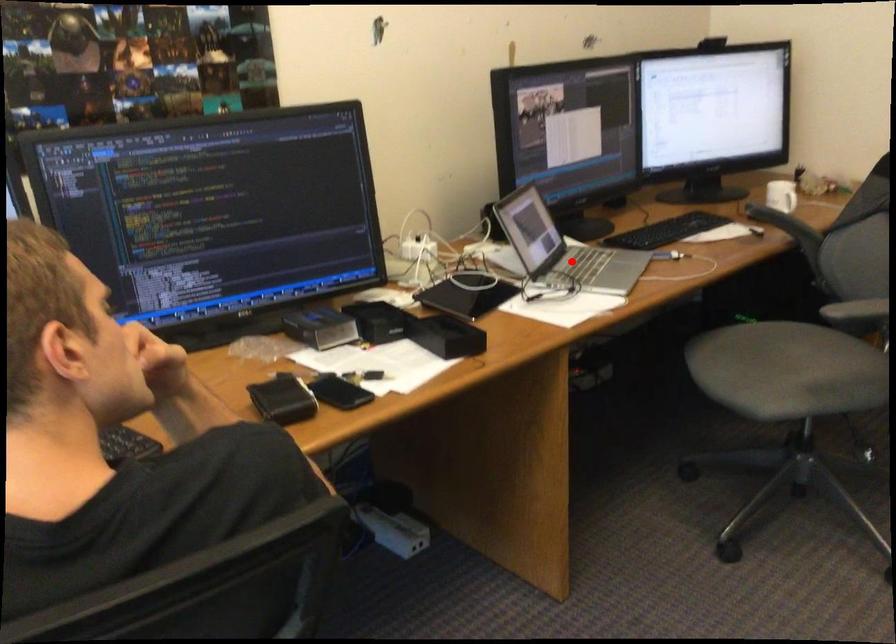
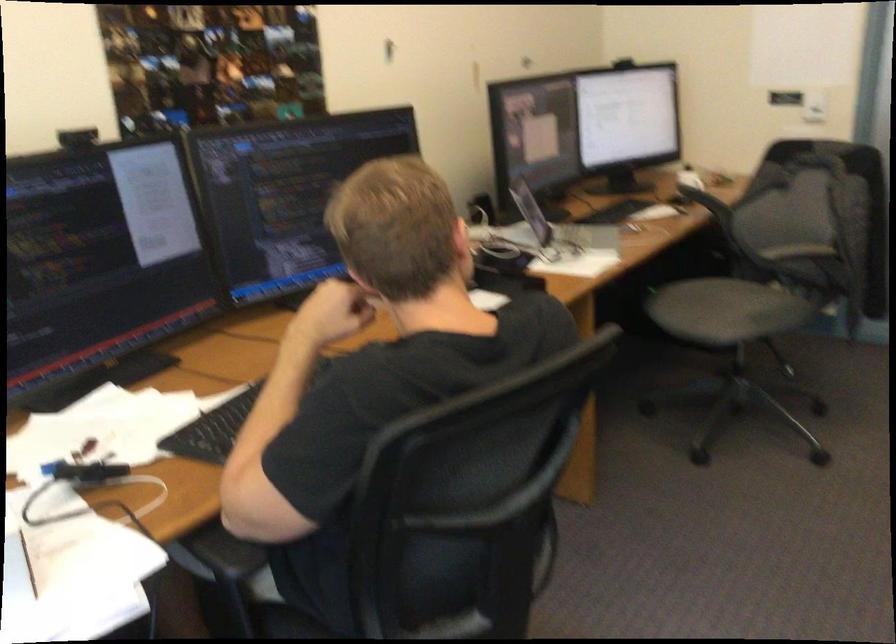
Question: I am providing you with two images of the same scene from different viewpoints. Given a red point in image1, look at the same physical point in image2. Is it:

Choices:
 (A) Closer to the viewpoint
 (B) Farther from the viewpoint

Answer: (B)